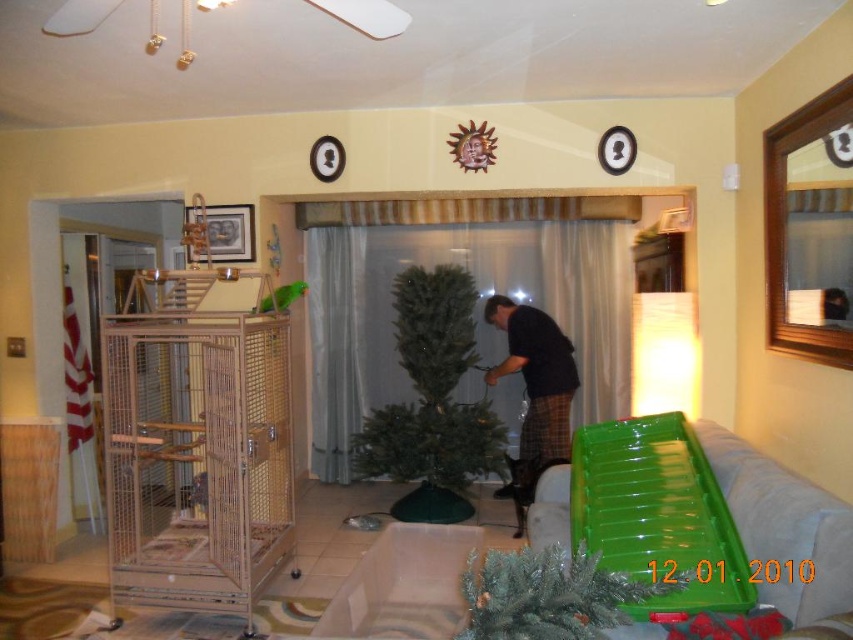
Question: From the image, what is the correct spatial relationship of green matte christmas tree at center in relation to black cotton shirt at center?

Choices:
 (A) above
 (B) below

Answer: (B)

Question: Does green matte christmas tree at center have a lesser width compared to green artificial tree at center?

Choices:
 (A) no
 (B) yes

Answer: (A)

Question: Which of these objects is positioned farthest from the green matte christmas tree at center?

Choices:
 (A) black cotton shirt at center
 (B) green artificial tree at center
 (C) metal mesh birdcage at left

Answer: (B)

Question: Is metal mesh birdcage at left below green matte christmas tree at center?

Choices:
 (A) no
 (B) yes

Answer: (B)

Question: Considering the real-world distances, which object is closest to the metal mesh birdcage at left?

Choices:
 (A) green artificial tree at center
 (B) black cotton shirt at center
 (C) green matte christmas tree at center

Answer: (C)

Question: Which object appears closest to the camera in this image?

Choices:
 (A) green artificial tree at center
 (B) black cotton shirt at center
 (C) green matte christmas tree at center
 (D) metal mesh birdcage at left

Answer: (A)